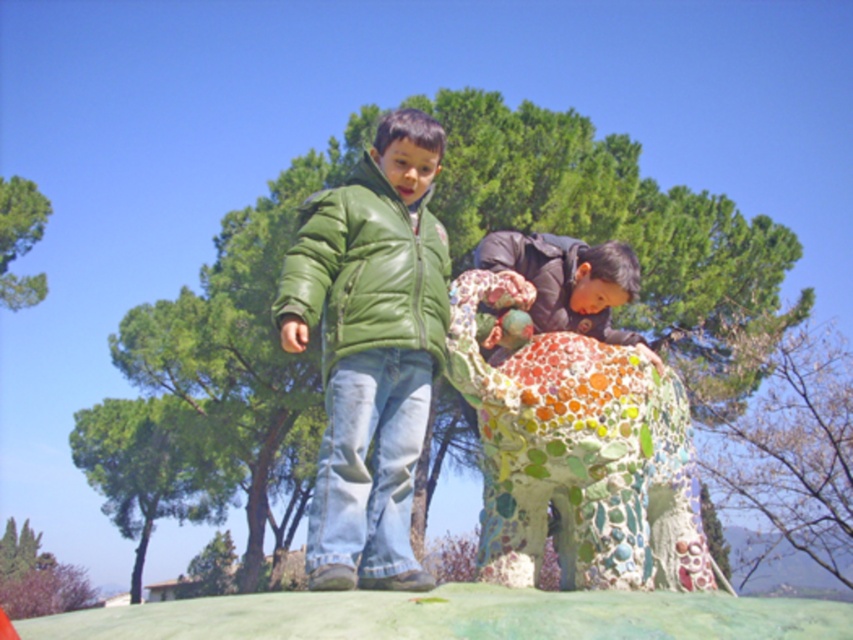
You are a photographer trying to capture a full view of the mosaic elephant at center and the green leather jacket at center in one shot. Based on their sizes, which object should you focus on first to ensure both are in frame?

The mosaic elephant at center is taller than the green leather jacket at center, so you should focus on positioning the camera to include the taller mosaic elephant at center first to ensure both are in frame.

You are a fashion designer observing two jackets in an image. The jackets are labeled as the green matte jacket at center and the green leather jacket at center. Which jacket would you recommend to a client who wants a more voluminous look?

The green matte jacket at center has a larger size compared to the green leather jacket at center, so it would be the better choice for a more voluminous look.

Looking at this image, you are a photographer standing at point A. You want to take a photo of the mosaic sculpture elephant. There are two points marked in the scene. The first point is at coordinates point [589,532] and the second point is at coordinates point [625,262]. Which point should you stand at to ensure the sculpture is fully visible without any obstruction?

You should stand at point [589,532] because it is in front of point [625,262], providing a clearer and unobstructed view of the mosaic sculpture elephant.